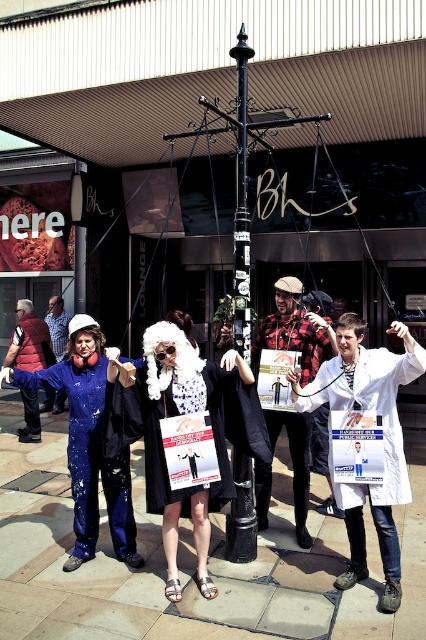
You are a photographer trying to capture a photo of the white lab coat at center and the black metal pole at center. Which object should you focus on first if you want to include both in the frame without moving the camera?

The white lab coat at center is shorter than the black metal pole at center, so you should focus on the white lab coat at center first to ensure it is in frame before the taller pole obscures it.

Please provide the 2D coordinates of the blue paint splattered jumpsuit at left in the scene.

The blue paint splattered jumpsuit at left is located at coordinates (89, 452).